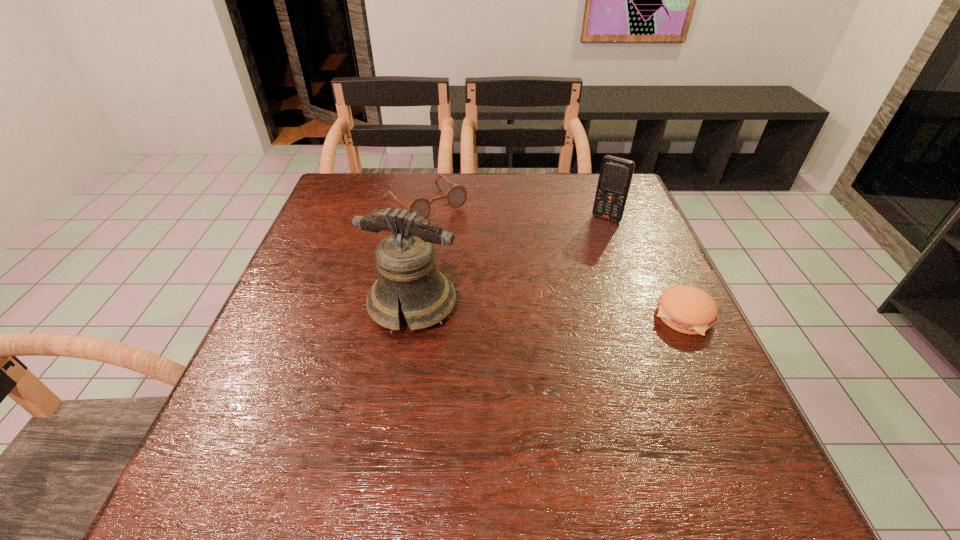
Identify the location of vacant space on the desktop that is between the tallest object and the patty and is positioned on the front-facing side of the spectacles. This screenshot has width=960, height=540. (543, 310).

The image size is (960, 540). I want to click on free space on the desktop that is between the bell and the shortest object and is positioned on the screen of the third shortest object, so click(543, 310).